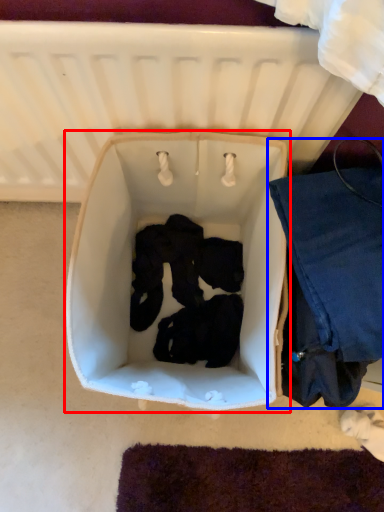
Question: Among these objects, which one is nearest to the camera, baby carriage (highlighted by a red box) or clothing (highlighted by a blue box)?

Choices:
 (A) baby carriage
 (B) clothing

Answer: (B)